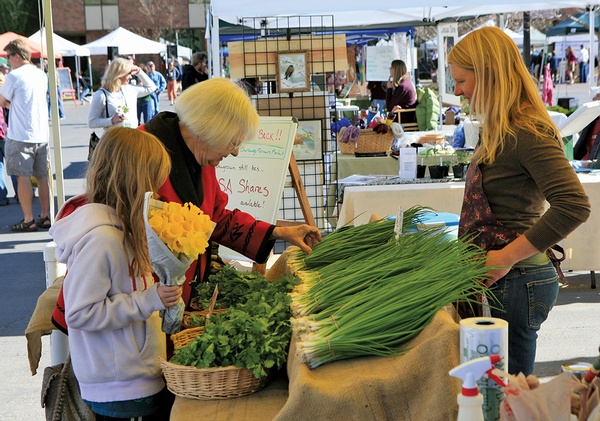
The image size is (600, 421). Identify the location of baskets. (208, 310), (220, 375), (376, 137).